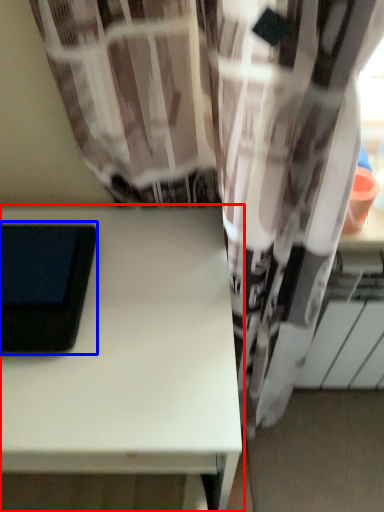
Question: Among these objects, which one is farthest to the camera, table (highlighted by a red box) or ipad (highlighted by a blue box)?

Choices:
 (A) table
 (B) ipad

Answer: (B)